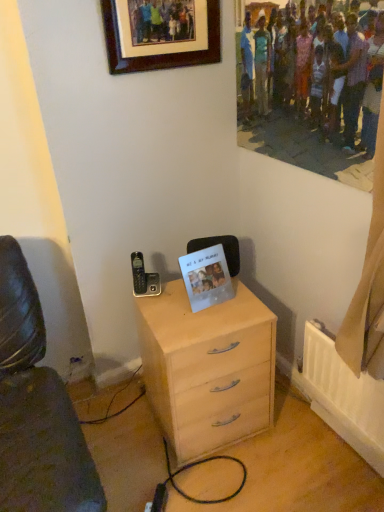
Question: From the image's perspective, is transparent plastic photo frame at center above light wood chest of drawers at center?

Choices:
 (A) no
 (B) yes

Answer: (B)

Question: Are transparent plastic photo frame at center and light wood chest of drawers at center located far from each other?

Choices:
 (A) yes
 (B) no

Answer: (B)

Question: Considering the relative sizes of transparent plastic photo frame at center and light wood chest of drawers at center in the image provided, is transparent plastic photo frame at center shorter than light wood chest of drawers at center?

Choices:
 (A) yes
 (B) no

Answer: (A)

Question: Is transparent plastic photo frame at center thinner than light wood chest of drawers at center?

Choices:
 (A) yes
 (B) no

Answer: (A)

Question: Is transparent plastic photo frame at center located outside light wood chest of drawers at center?

Choices:
 (A) yes
 (B) no

Answer: (A)

Question: Is transparent plastic photo frame at center wider than light wood chest of drawers at center?

Choices:
 (A) yes
 (B) no

Answer: (B)

Question: From the image's perspective, is brown wooden picture frame at upper center under light wood chest of drawers at center?

Choices:
 (A) yes
 (B) no

Answer: (B)

Question: Considering the relative positions of brown wooden picture frame at upper center and light wood chest of drawers at center in the image provided, is brown wooden picture frame at upper center to the left of light wood chest of drawers at center from the viewer's perspective?

Choices:
 (A) no
 (B) yes

Answer: (B)

Question: Is the depth of brown wooden picture frame at upper center less than that of light wood chest of drawers at center?

Choices:
 (A) yes
 (B) no

Answer: (A)

Question: Is brown wooden picture frame at upper center touching light wood chest of drawers at center?

Choices:
 (A) yes
 (B) no

Answer: (B)

Question: From a real-world perspective, is brown wooden picture frame at upper center beneath light wood chest of drawers at center?

Choices:
 (A) no
 (B) yes

Answer: (A)

Question: Is brown wooden picture frame at upper center outside light wood chest of drawers at center?

Choices:
 (A) no
 (B) yes

Answer: (B)

Question: Is the depth of light wood chest of drawers at center greater than that of transparent plastic photo frame at center?

Choices:
 (A) no
 (B) yes

Answer: (A)